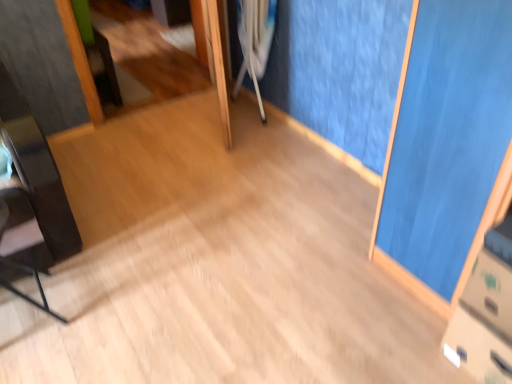
You are a GUI agent. You are given a task and a screenshot of the screen. Output one action in this format:
    pyautogui.click(x=<x>, y=<y>)
    Task: Click on the free space between matte black chair at left and white plastic crutch at center
    
    Given the screenshot: What is the action you would take?
    pyautogui.click(x=155, y=208)